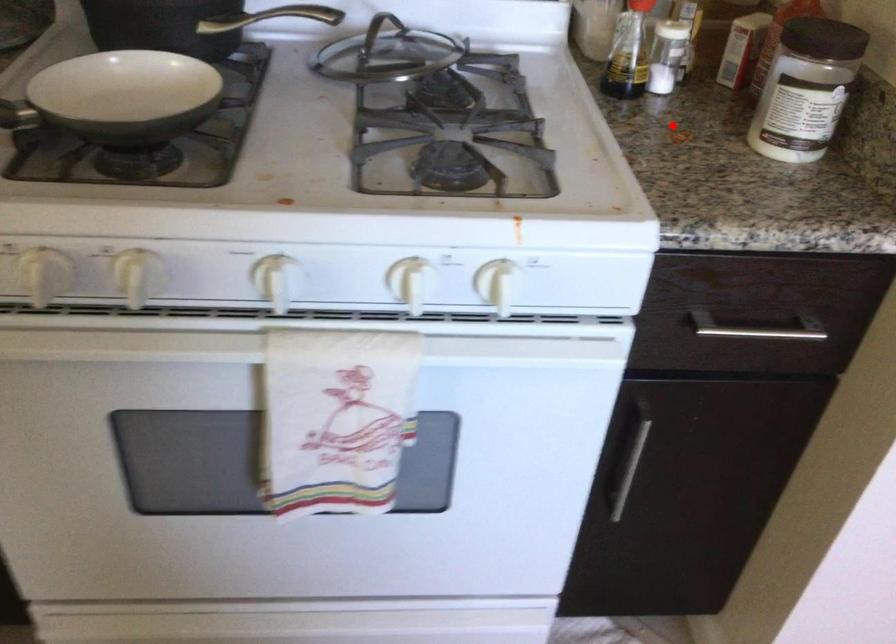
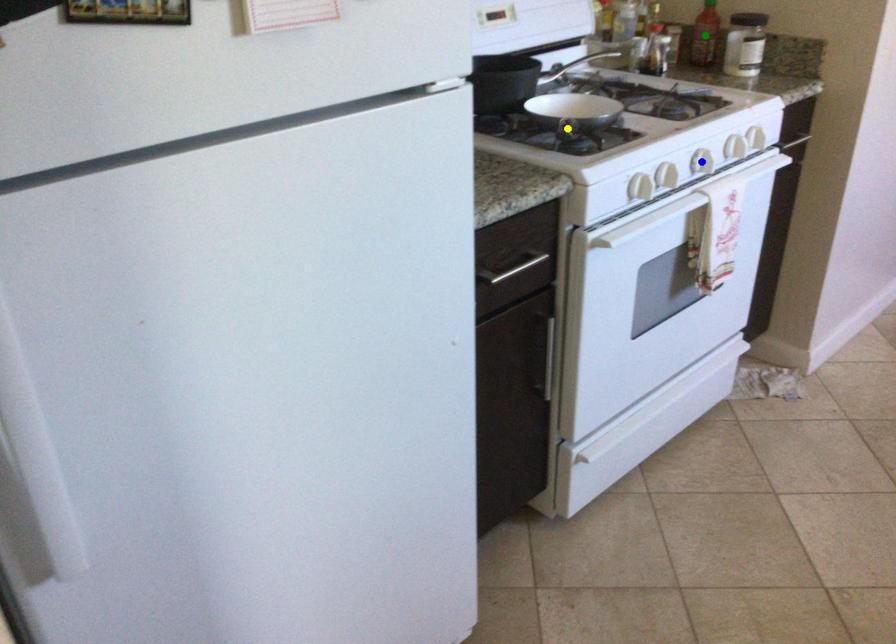
Question: I am providing you with two images of the same scene from different viewpoints. A red point is marked on the first image. You are given multiple points on the second image. Which point in image 2 is actually the same real-world point as the red point in image 1?

Choices:
 (A) blue point
 (B) green point
 (C) yellow point

Answer: (B)